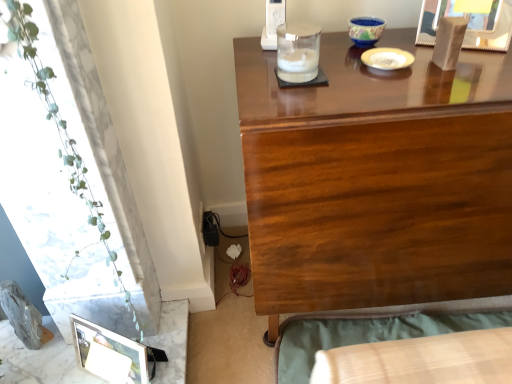
Locate an element on the screen. The width and height of the screenshot is (512, 384). vacant area situated to the left side of white glossy plate at upper center is located at coordinates (321, 67).